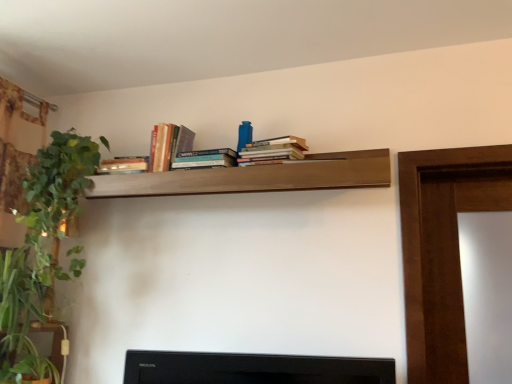
Question: From a real-world perspective, is wooden shelf at upper center beneath green leafy plant at left?

Choices:
 (A) yes
 (B) no

Answer: (B)

Question: Does wooden shelf at upper center have a larger size compared to green leafy plant at left?

Choices:
 (A) no
 (B) yes

Answer: (B)

Question: Is the surface of wooden shelf at upper center in direct contact with green leafy plant at left?

Choices:
 (A) yes
 (B) no

Answer: (B)

Question: Is wooden shelf at upper center further to camera compared to green leafy plant at left?

Choices:
 (A) yes
 (B) no

Answer: (B)

Question: Is wooden shelf at upper center positioned before green leafy plant at left?

Choices:
 (A) no
 (B) yes

Answer: (B)

Question: Does point (177, 163) appear closer or farther from the camera than point (9, 354)?

Choices:
 (A) closer
 (B) farther

Answer: (A)

Question: Looking at their shapes, would you say hardcover books at center, the 2th book viewed from the left, is wider or thinner than green leafy plant at left?

Choices:
 (A) thin
 (B) wide

Answer: (A)

Question: Considering the positions of hardcover books at center, positioned as the second book in right-to-left order, and green leafy plant at left in the image, is hardcover books at center, positioned as the second book in right-to-left order, taller or shorter than green leafy plant at left?

Choices:
 (A) short
 (B) tall

Answer: (A)

Question: From the image's perspective, is hardcover books at center, positioned as the second book in right-to-left order, above or below green leafy plant at left?

Choices:
 (A) below
 (B) above

Answer: (B)

Question: Is green leafy plant at left inside or outside of green leafy plant at left?

Choices:
 (A) inside
 (B) outside

Answer: (B)

Question: Considering the positions of green leafy plant at left and green leafy plant at left in the image, is green leafy plant at left taller or shorter than green leafy plant at left?

Choices:
 (A) short
 (B) tall

Answer: (B)

Question: Considering the positions of point (18, 370) and point (55, 334), is point (18, 370) closer or farther from the camera than point (55, 334)?

Choices:
 (A) farther
 (B) closer

Answer: (B)

Question: From a real-world perspective, is green leafy plant at left positioned above or below green leafy plant at left?

Choices:
 (A) below
 (B) above

Answer: (B)

Question: From a real-world perspective, is green leafy plant at left positioned above or below hardcover books at upper center, the first book viewed from the left?

Choices:
 (A) below
 (B) above

Answer: (A)

Question: Considering their positions, is green leafy plant at left located in front of or behind hardcover books at upper center, arranged as the 3th book when viewed from the right?

Choices:
 (A) front
 (B) behind

Answer: (A)